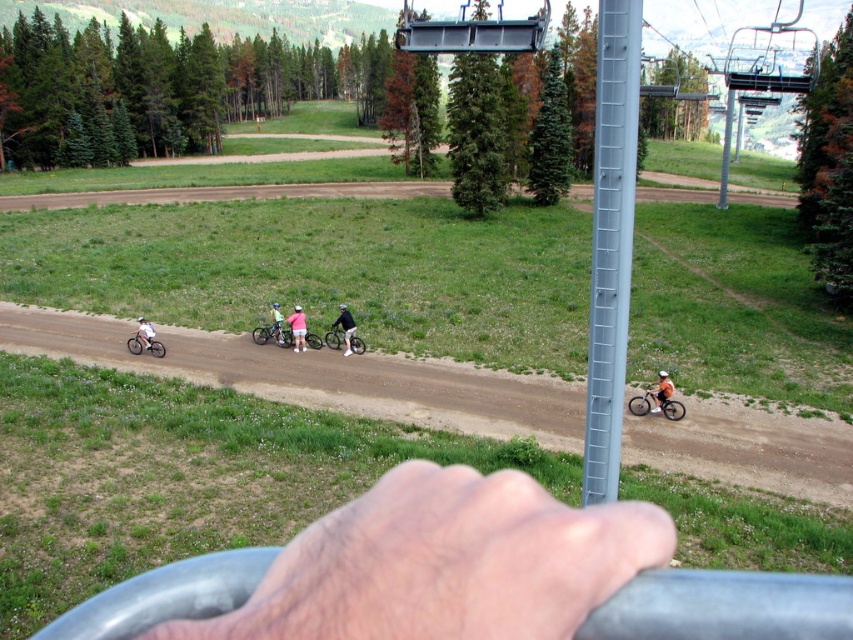
Is point (334, 339) positioned after point (140, 330)?

Yes, it is behind point (140, 330).

Which is above, shiny metallic bicycle at center or white matte bicycle at left?

white matte bicycle at left is above.

Is point (323, 340) positioned before point (140, 324)?

No, it is behind (140, 324).

In order to click on shiny metallic bicycle at center in this screenshot , I will do `click(334, 339)`.

Does matte black dirt bike at left have a greater width compared to light pink fabric shorts at center?

Yes.

Is matte black dirt bike at left smaller than light pink fabric shorts at center?

No, matte black dirt bike at left is not smaller than light pink fabric shorts at center.

The width and height of the screenshot is (853, 640). What do you see at coordinates (144, 342) in the screenshot?
I see `matte black dirt bike at left` at bounding box center [144, 342].

I want to click on matte black dirt bike at left, so click(144, 342).

Between matte black dirt bike at left and white matte helmet at center, which one appears on the right side from the viewer's perspective?

From the viewer's perspective, white matte helmet at center appears more on the right side.

The image size is (853, 640). What are the coordinates of `matte black dirt bike at left` in the screenshot? It's located at (144, 342).